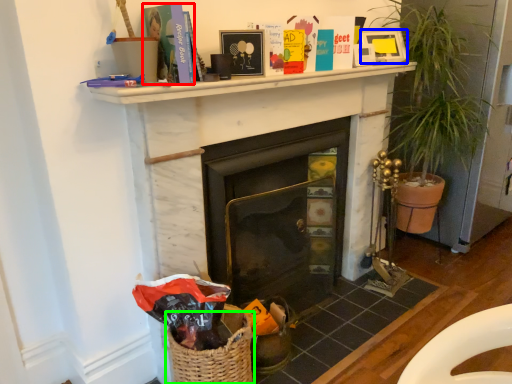
Question: Which object is the farthest from paperback book (highlighted by a red box)? Choose among these: picture frame (highlighted by a blue box) or basket (highlighted by a green box).

Choices:
 (A) picture frame
 (B) basket

Answer: (A)